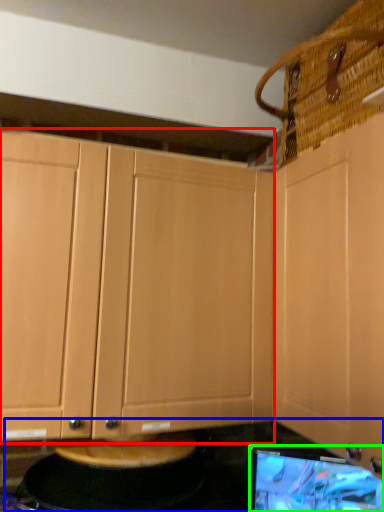
Question: Considering the real-world distances, which object is farthest from cabinetry (highlighted by a red box)? counter top (highlighted by a blue box) or computer monitor (highlighted by a green box)?

Choices:
 (A) counter top
 (B) computer monitor

Answer: (B)